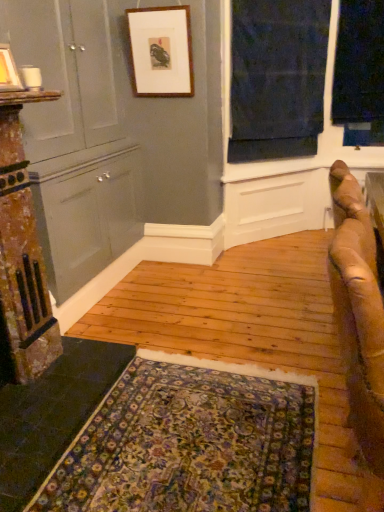
Question: From the image's perspective, is brown leather couch at right located beneath floral carpet at lower center?

Choices:
 (A) yes
 (B) no

Answer: (B)

Question: Is brown leather couch at right not within floral carpet at lower center?

Choices:
 (A) no
 (B) yes

Answer: (B)

Question: Considering the relative sizes of brown leather couch at right and floral carpet at lower center in the image provided, is brown leather couch at right shorter than floral carpet at lower center?

Choices:
 (A) yes
 (B) no

Answer: (B)

Question: Can you confirm if brown leather couch at right is thinner than floral carpet at lower center?

Choices:
 (A) no
 (B) yes

Answer: (B)

Question: From a real-world perspective, does brown leather couch at right sit lower than floral carpet at lower center?

Choices:
 (A) no
 (B) yes

Answer: (A)

Question: Is brown leather couch at right aimed at floral carpet at lower center?

Choices:
 (A) yes
 (B) no

Answer: (B)

Question: Is wooden picture frame at upper center, positioned as the second picture frame in front-to-back order, positioned far away from matte gray dresser at left?

Choices:
 (A) yes
 (B) no

Answer: (B)

Question: Is wooden picture frame at upper center, which appears as the first picture frame when viewed from the top, oriented towards matte gray dresser at left?

Choices:
 (A) yes
 (B) no

Answer: (B)

Question: Is wooden picture frame at upper center, which appears as the first picture frame when viewed from the top, in contact with matte gray dresser at left?

Choices:
 (A) yes
 (B) no

Answer: (B)

Question: Considering the relative sizes of wooden picture frame at upper center, positioned as the second picture frame in front-to-back order, and matte gray dresser at left in the image provided, is wooden picture frame at upper center, positioned as the second picture frame in front-to-back order, shorter than matte gray dresser at left?

Choices:
 (A) no
 (B) yes

Answer: (B)

Question: Would you say wooden picture frame at upper center, arranged as the 1th picture frame when viewed from the right, is outside matte gray dresser at left?

Choices:
 (A) yes
 (B) no

Answer: (A)

Question: Is wooden picture frame at upper center, the second picture frame ordered from the bottom, to the right of matte gray dresser at left from the viewer's perspective?

Choices:
 (A) yes
 (B) no

Answer: (A)

Question: From the image's perspective, is dark blue fabric at upper right on matte gray dresser at left?

Choices:
 (A) yes
 (B) no

Answer: (A)